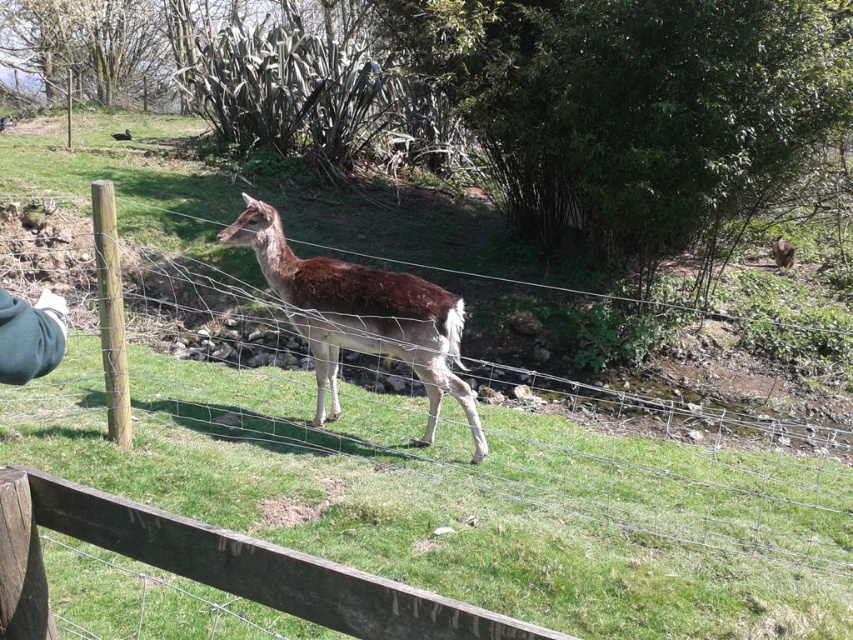
Does wooden fence at center appear over brown fur deer at center?

Incorrect, wooden fence at center is not positioned above brown fur deer at center.

Between point (779, 605) and point (780, 262), which one is positioned in front?

Positioned in front is point (779, 605).

The height and width of the screenshot is (640, 853). In order to click on wooden fence at center in this screenshot , I will do `click(454, 481)`.

Between brown speckled fur at center and brown fur deer at center, which one is positioned lower?

brown speckled fur at center

Measure the distance from brown speckled fur at center to brown fur deer at center.

The distance of brown speckled fur at center from brown fur deer at center is 11.16 meters.

The height and width of the screenshot is (640, 853). What are the coordinates of `brown speckled fur at center` in the screenshot? It's located at (361, 316).

The image size is (853, 640). In order to click on wooden fence at center in this screenshot , I will do `click(454, 481)`.

Does wooden fence at center come in front of brown speckled fur at center?

Yes.

Where is `wooden fence at center`? wooden fence at center is located at coordinates tap(454, 481).